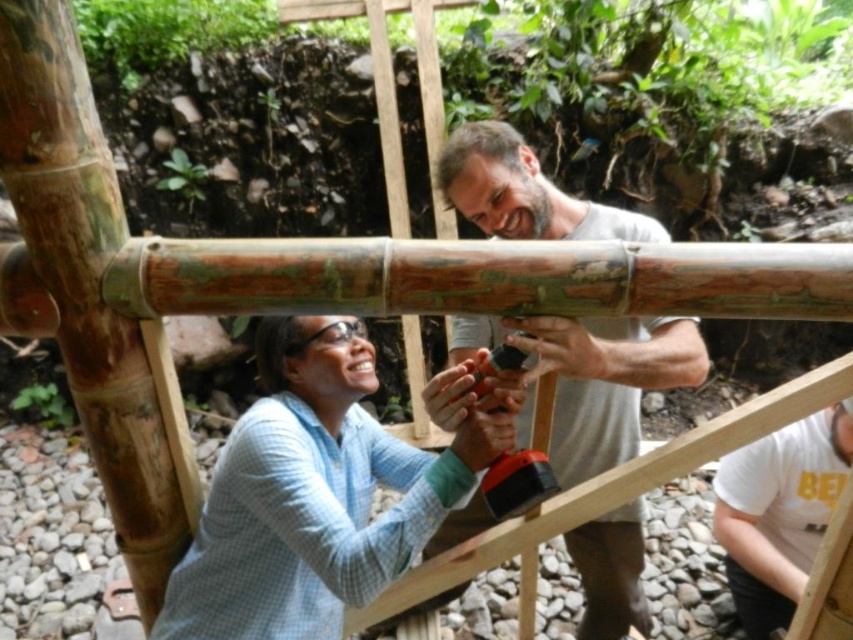
You are observing two people working on a bamboo structure in a rustic setting. You notice a light blue checkered shirt at center and a smooth gray shirt at center. Which shirt is positioned to the left?

The light blue checkered shirt at center is to the left of the smooth gray shirt at center.

You are a photographer standing 10 feet away from the two people wearing the light blue checkered shirt at center and the smooth gray shirt at center. You want to take a photo that captures both of them in the same frame. Given that your camera has a 50mm lens, which has a field of view of about 46 degrees, can you estimate if they can both fit in the frame without moving them?

The light blue checkered shirt at center and smooth gray shirt at center are 14.48 inches apart. At a distance of 10 feet, the angular size between them would be approximately 7.8 degrees, which is within the 46 degree field of view of the 50mm lens. Therefore, both individuals can fit in the frame without moving them.

You are standing at the point labeled point (706, 368) and want to walk to the point labeled point (390, 538). Which direction should you move in to reach your destination?

You should move forward because point 0.842, 055 is in front of point (706, 368).